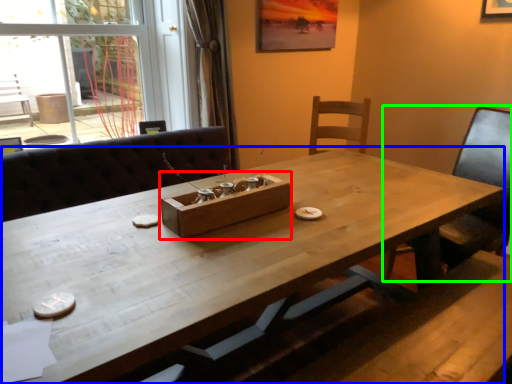
Question: Which object is positioned farthest from cardboard box (highlighted by a red box)? Select from table (highlighted by a blue box) and chair (highlighted by a green box).

Choices:
 (A) table
 (B) chair

Answer: (B)